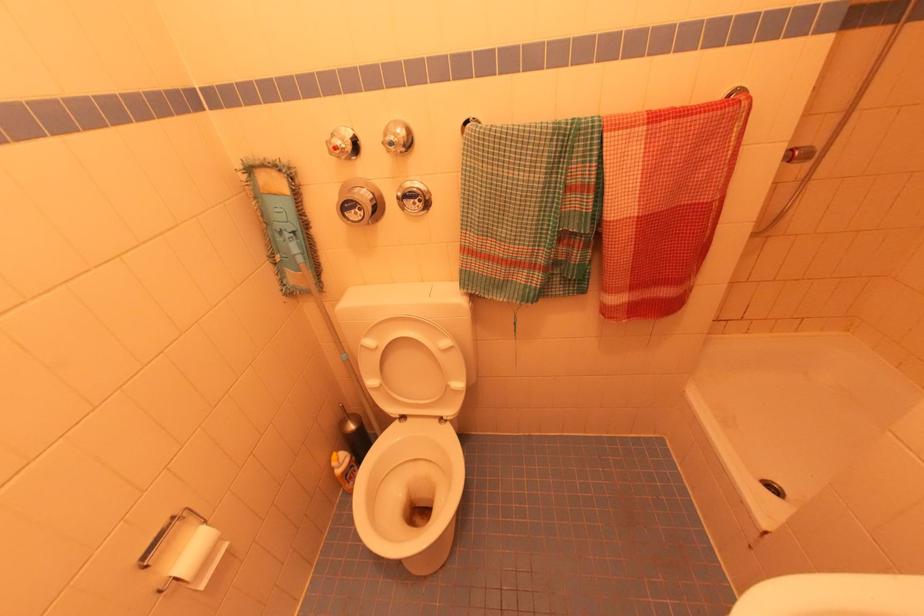
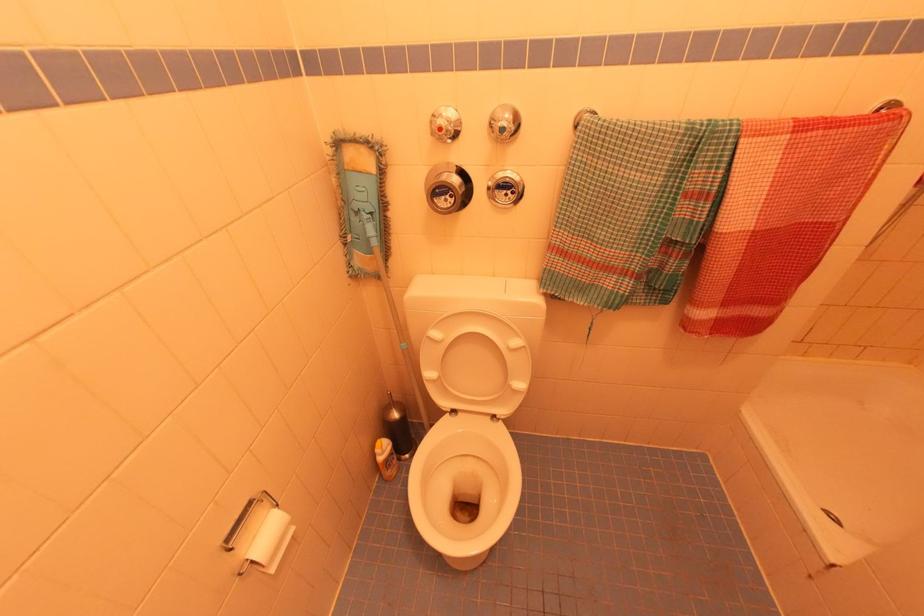
Find the pixel in the second image that matches the point at 397,124 in the first image.

(505, 108)